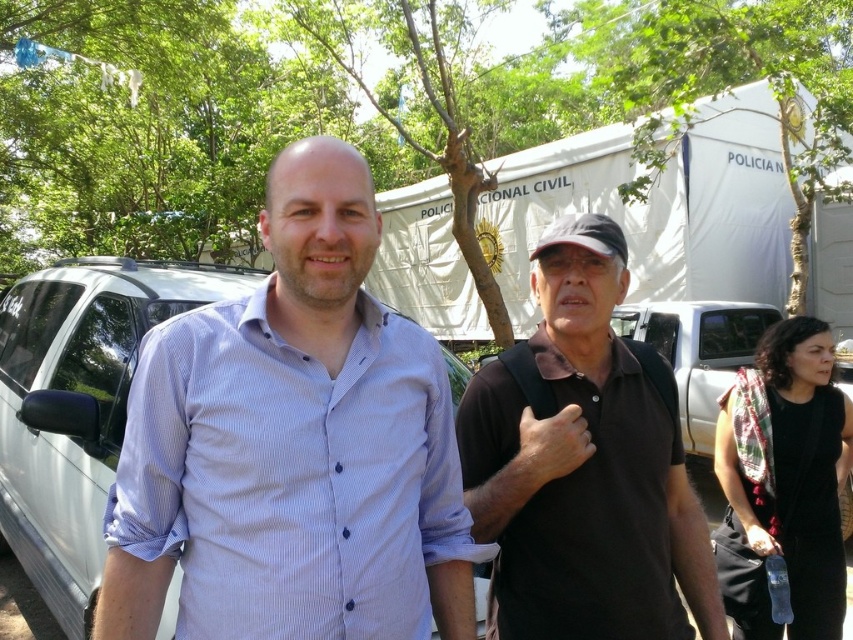
You are a photographer trying to frame a shot of the black matte polo shirt at center and the smooth skin hand at lower right. Based on their positions, which object should you prioritize placing closer to the edge of the frame to maintain balance?

The smooth skin hand at lower right should be placed closer to the edge of the frame since it is narrower than the black matte polo shirt at center.

You are a photographer at the event and need to ensure that both the black fabric dress at lower right and the smooth skin hand at lower right are visible in your photo. Considering their sizes, which object should you focus on to ensure both are in frame?

The black fabric dress at lower right has a larger size compared to smooth skin hand at lower right. To ensure both are in frame, focus on the larger object, the black fabric dress at lower right, as it requires more space and the smaller hand will naturally fit within the same composition.

You are standing at the point with coordinates point [517,470]. You want to walk to the point with coordinates point [213,419]. Which direction should you move?

You should move forward because point [213,419] is in front of point [517,470].